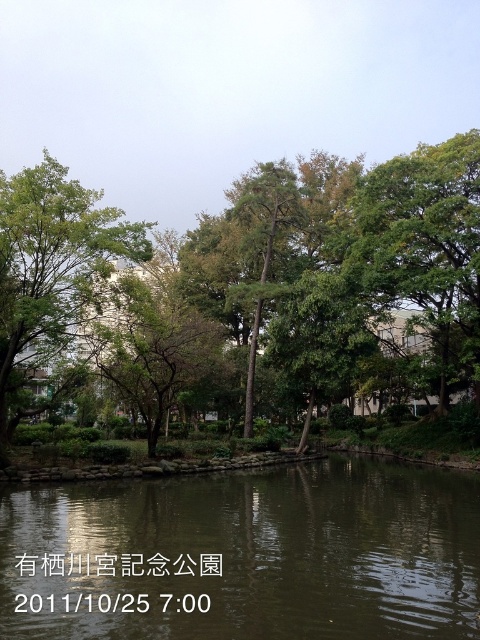
You are standing in the park and want to take a photo of both the green reflective water at center and the green leafy tree at right. To ensure both are in the frame, should you position yourself to the left or right of the tree?

You should position yourself to the left of the green leafy tree at right because the green reflective water at center is on the left side of the tree, so placing yourself to the left will keep both objects within the camera frame.

You are standing in the park and want to walk from the point at coordinates point (x=19, y=612) to the point at coordinates point (x=462, y=172). Which direction should you face to walk towards your destination?

You should face towards the northwest direction to walk from point (x=19, y=612) to point (x=462, y=172).